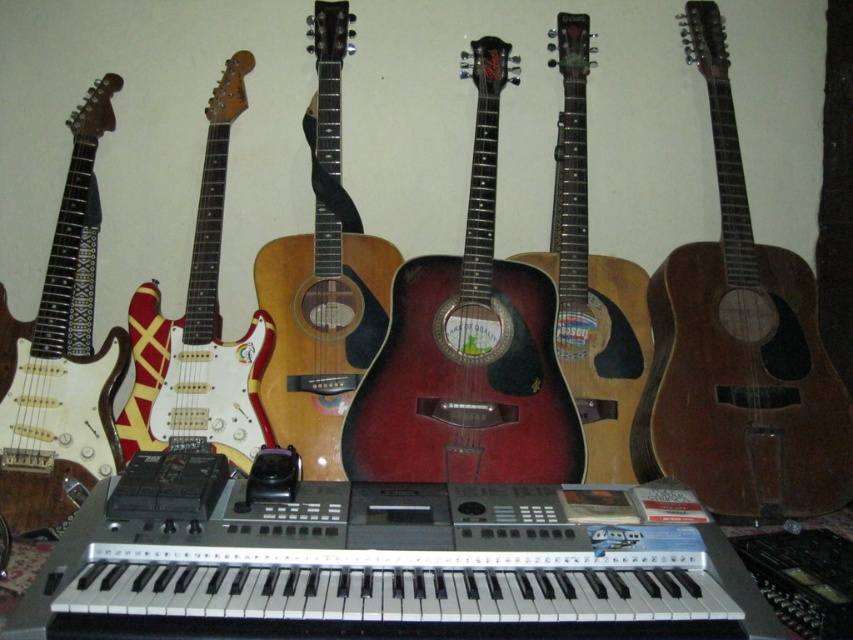
Does point (115, 333) come in front of point (184, 340)?

No, (115, 333) is behind (184, 340).

Does white glossy electric guitar at left have a lesser height compared to white glossy electric guitar at center-left?

Incorrect, white glossy electric guitar at left's height does not fall short of white glossy electric guitar at center-left's.

The width and height of the screenshot is (853, 640). In order to click on white glossy electric guitar at left in this screenshot , I will do `click(59, 360)`.

You are a GUI agent. You are given a task and a screenshot of the screen. Output one action in this format:
    pyautogui.click(x=<x>, y=<y>)
    Task: Click on the white glossy electric guitar at left
    This screenshot has width=853, height=640.
    Given the screenshot: What is the action you would take?
    point(59,360)

Who is more forward, (811, 378) or (184, 385)?

Point (184, 385) is more forward.

This screenshot has width=853, height=640. Find the location of `brown wooden guitar at right`. brown wooden guitar at right is located at coordinates (740, 349).

Is the position of brown wooden guitar at right less distant than that of white glossy electric guitar at left?

Yes, it is.

Based on the photo, which of these two, brown wooden guitar at right or white glossy electric guitar at left, stands taller?

A: With more height is brown wooden guitar at right.

Is point (782, 417) farther from viewer compared to point (78, 122)?

No, (782, 417) is closer to viewer.

In order to click on brown wooden guitar at right in this screenshot , I will do `click(740, 349)`.